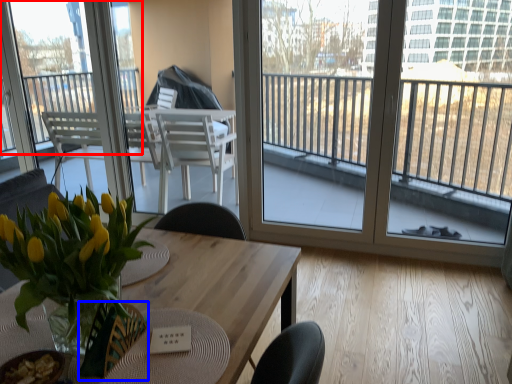
Question: Which point is closer to the camera, window (highlighted by a red box) or armchair (highlighted by a blue box)?

Choices:
 (A) window
 (B) armchair

Answer: (B)